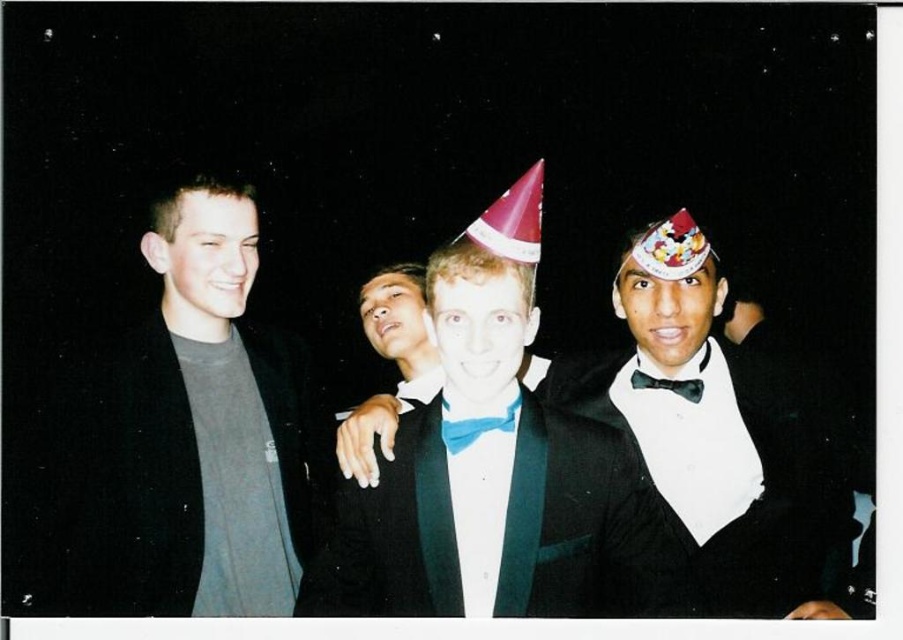
Is point (443, 403) closer to camera compared to point (659, 381)?

Yes, point (443, 403) is closer to viewer.

Between point (450, 428) and point (672, 380), which one is positioned behind?

Positioned behind is point (672, 380).

This screenshot has height=640, width=903. I want to click on blue satin bow tie at center, so click(x=477, y=426).

Who is more forward, (x=182, y=374) or (x=459, y=445)?

Positioned in front is point (x=459, y=445).

From the picture: Which of these two, gray cotton t-shirt at left or blue satin bow tie at center, stands shorter?

With less height is blue satin bow tie at center.

Between point (151, 410) and point (469, 424), which one is positioned in front?

Point (469, 424) is more forward.

Locate an element on the screen. Image resolution: width=903 pixels, height=640 pixels. gray cotton t-shirt at left is located at coordinates (198, 436).

Does shiny black tuxedo at center appear under black satin bow tie at center?

Yes, shiny black tuxedo at center is below black satin bow tie at center.

Is point (619, 403) closer to viewer compared to point (685, 392)?

No, it is not.

Find the location of a particular element. This screenshot has height=640, width=903. shiny black tuxedo at center is located at coordinates (723, 432).